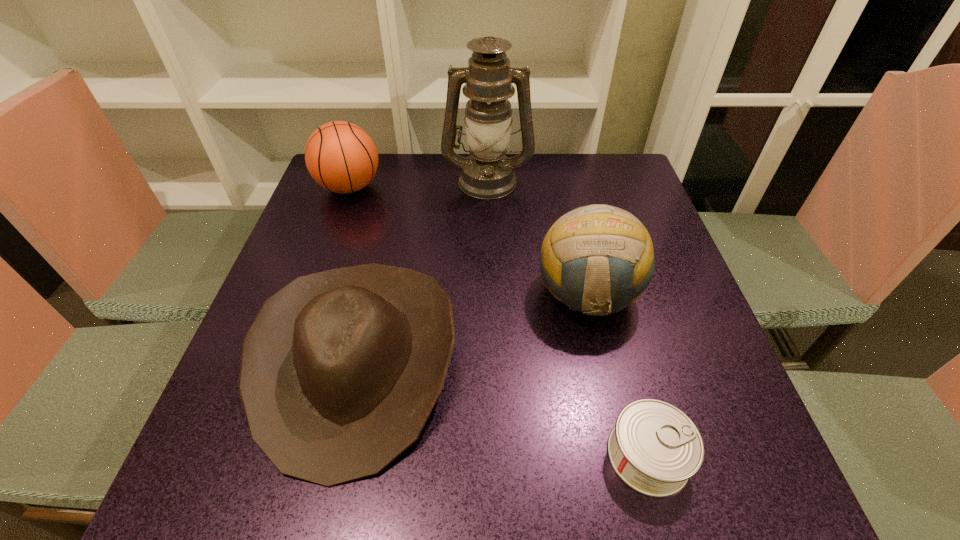
Identify the location of oil lamp situated at the far edge. (487, 173).

This screenshot has height=540, width=960. What are the coordinates of `basketball that is positioned at the far edge` in the screenshot? It's located at (340, 156).

At what (x,y) coordinates should I click in order to perform the action: click on cowboy hat that is at the near edge. Please return your answer as a coordinate pair (x, y). The width and height of the screenshot is (960, 540). Looking at the image, I should click on (340, 370).

I want to click on can positioned at the near edge, so click(x=654, y=447).

The width and height of the screenshot is (960, 540). I want to click on basketball present at the left edge, so click(x=340, y=156).

Locate an element on the screen. This screenshot has width=960, height=540. cowboy hat that is at the left edge is located at coordinates (340, 370).

Identify the location of volleyball that is at the right edge. (597, 259).

Where is `can situated at the right edge`? can situated at the right edge is located at coordinates (654, 447).

Locate an element on the screen. This screenshot has width=960, height=540. object that is at the far left corner is located at coordinates (340, 156).

Where is `object that is at the near left corner`? The image size is (960, 540). object that is at the near left corner is located at coordinates (340, 370).